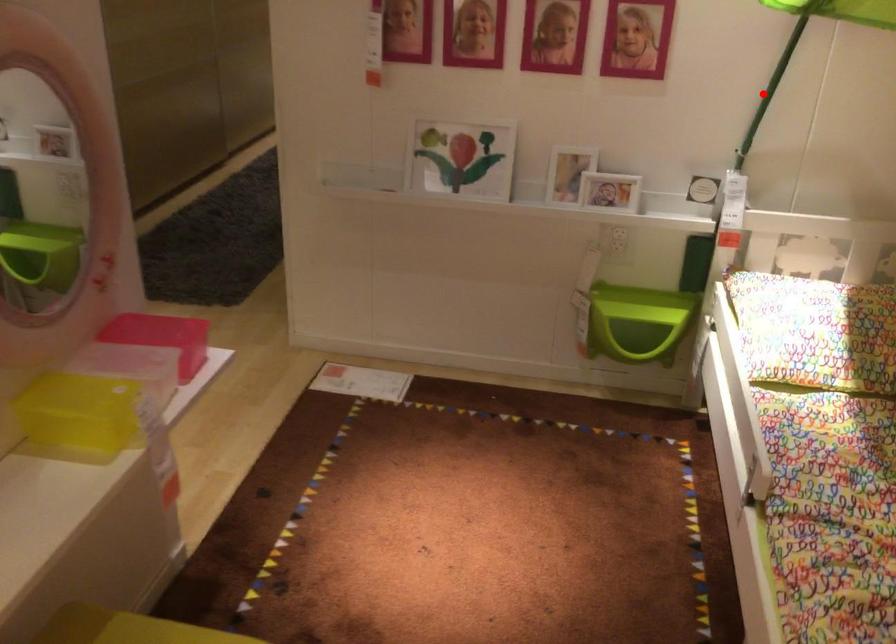
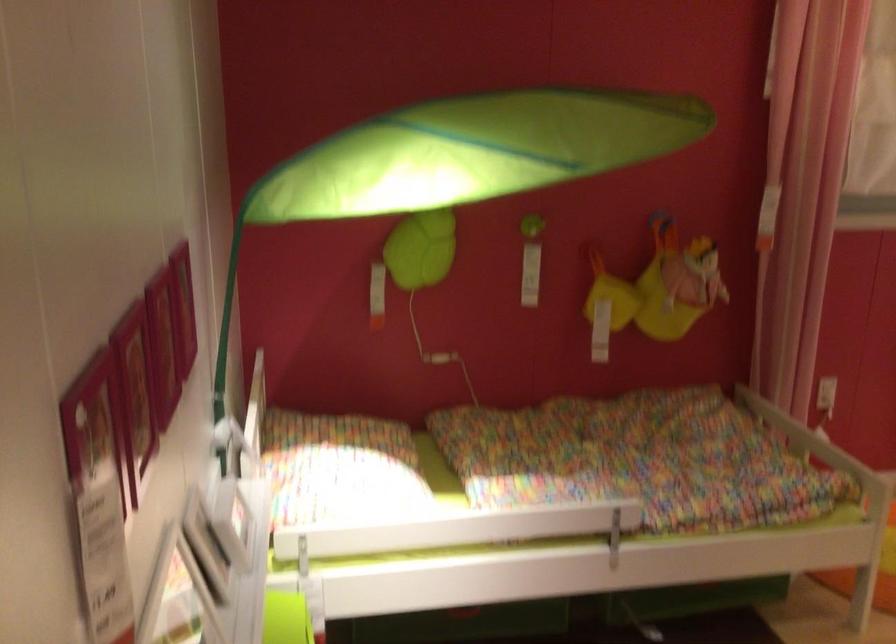
Where in the second image is the point corresponding to the highlighted location from the first image?

(226, 339)